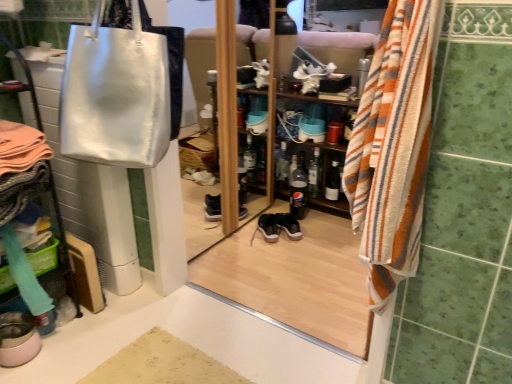
I want to click on blank area beneath beige textured bath mat at lower center (from a real-world perspective), so click(x=159, y=362).